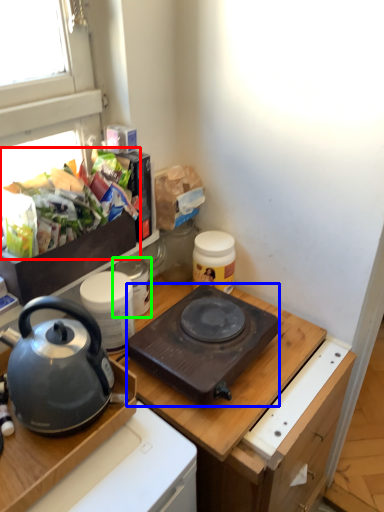
Question: Estimate the real-world distances between objects in this image. Which object is closer to food (highlighted by a red box), kitchen appliance (highlighted by a blue box) or appliance (highlighted by a green box)?

Choices:
 (A) kitchen appliance
 (B) appliance

Answer: (B)